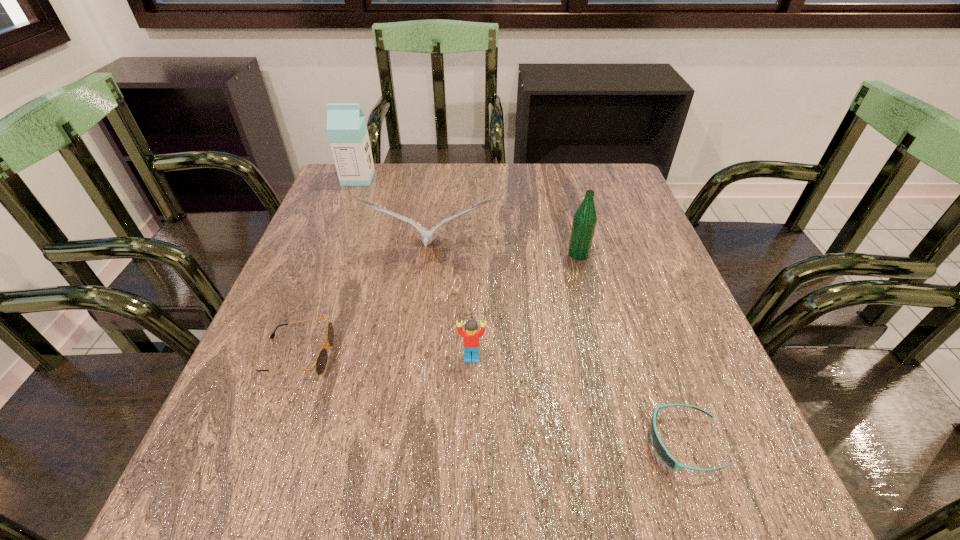
Identify which object is the nearest to the tallest object. Please provide its 2D coordinates. Your answer should be formatted as a tuple, i.e. [(x, y)], where the tuple contains the x and y coordinates of a point satisfying the conditions above.

[(427, 236)]

Find the location of `vacant area in the image that satisfies the following two spatial constraints: 1. at the tip of the beak of the gull; 2. on the front-facing side of the left sunglasses`. vacant area in the image that satisfies the following two spatial constraints: 1. at the tip of the beak of the gull; 2. on the front-facing side of the left sunglasses is located at coordinates (417, 355).

What are the coordinates of `free space that satisfies the following two spatial constraints: 1. on the front side of the bottle; 2. on the front-facing side of the left sunglasses` in the screenshot? It's located at (604, 355).